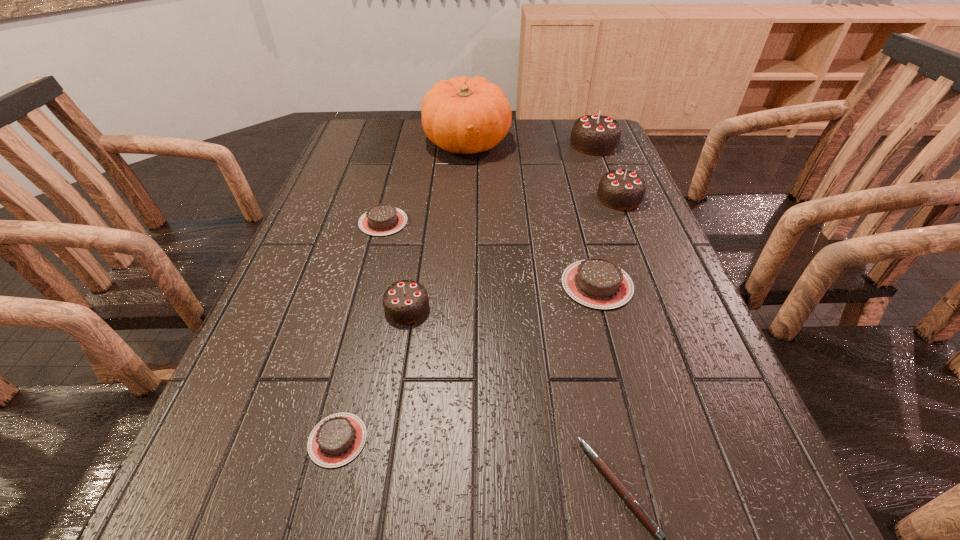
Where is `the farthest brown chocolate cake`? the farthest brown chocolate cake is located at coordinates (382, 219).

Where is `the fifth tallest chocolate cake`? the fifth tallest chocolate cake is located at coordinates (382, 219).

Locate an element on the screen. the shortest chocolate cake is located at coordinates [x=336, y=440].

Identify the location of the second shortest object. Image resolution: width=960 pixels, height=540 pixels. (336, 440).

You are a GUI agent. You are given a task and a screenshot of the screen. Output one action in this format:
    pyautogui.click(x=<x>, y=<y>)
    Task: Click on the vacant space located on the right of the tallest object
    
    Given the screenshot: What is the action you would take?
    [526, 143]

Locate an element on the screen. The width and height of the screenshot is (960, 540). blank space located 0.170m on the left of the biggest chocolate chocolate cake is located at coordinates (516, 144).

Identify the location of vacant space located 0.050m on the front of the second nearest chocolate chocolate cake. This screenshot has height=540, width=960. (630, 222).

What are the coordinates of `free space located 0.130m on the front of the fifth shortest object` in the screenshot? It's located at (395, 383).

At what (x,y) coordinates should I click in order to perform the action: click on free space located 0.200m on the back of the third shortest chocolate cake. Please return your answer as a coordinate pair (x, y). The height and width of the screenshot is (540, 960). Looking at the image, I should click on (577, 209).

You are a GUI agent. You are given a task and a screenshot of the screen. Output one action in this format:
    pyautogui.click(x=<x>, y=<y>)
    Task: Click on the free space located 0.360m on the back of the fifth tallest chocolate cake
    The height and width of the screenshot is (540, 960).
    Given the screenshot: What is the action you would take?
    pyautogui.click(x=404, y=142)